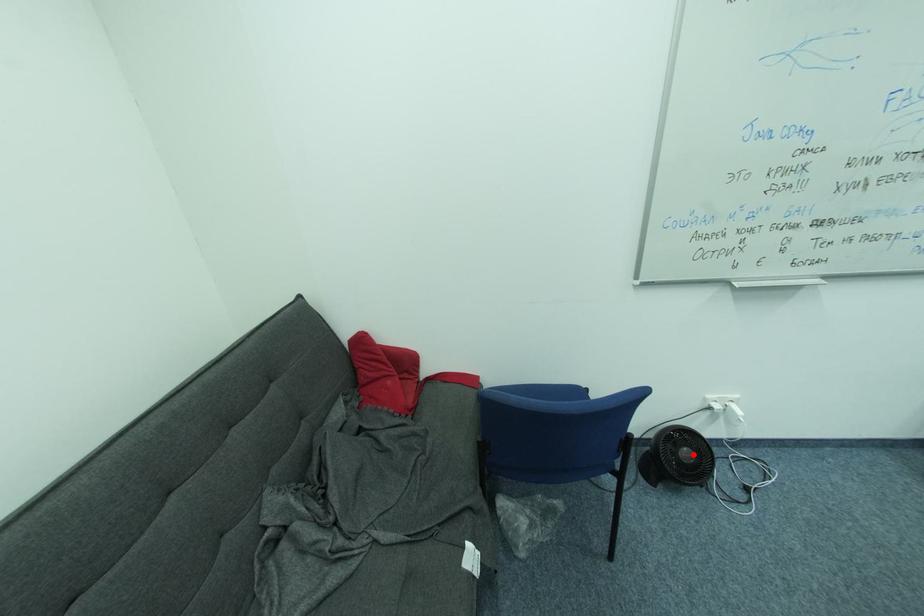
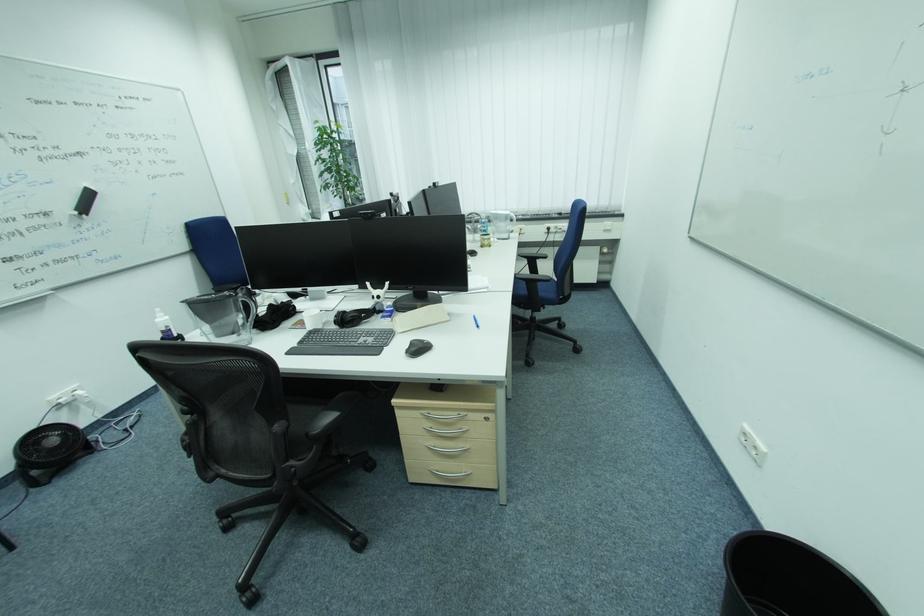
Where in the second image is the point corresponding to the highlighted location from the first image?

(59, 442)